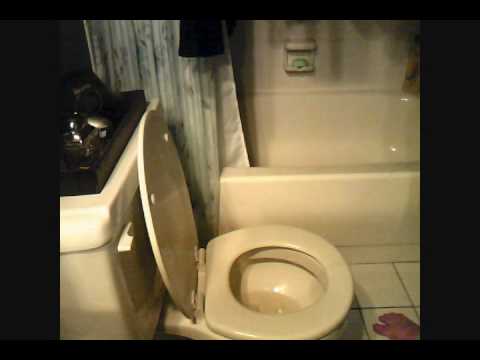
Locate an element on the screen. The image size is (480, 360). toilet seat is located at coordinates (234, 330).